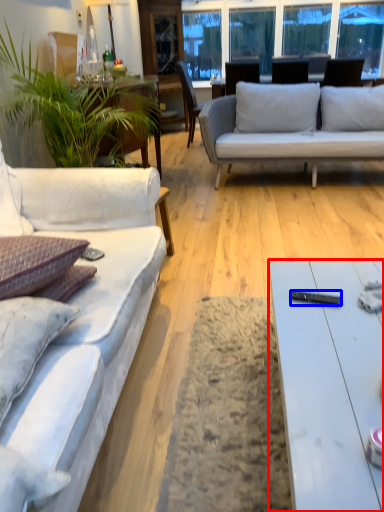
Question: Which of the following is the farthest to the observer, coffee table (highlighted by a red box) or remote control (highlighted by a blue box)?

Choices:
 (A) coffee table
 (B) remote control

Answer: (B)